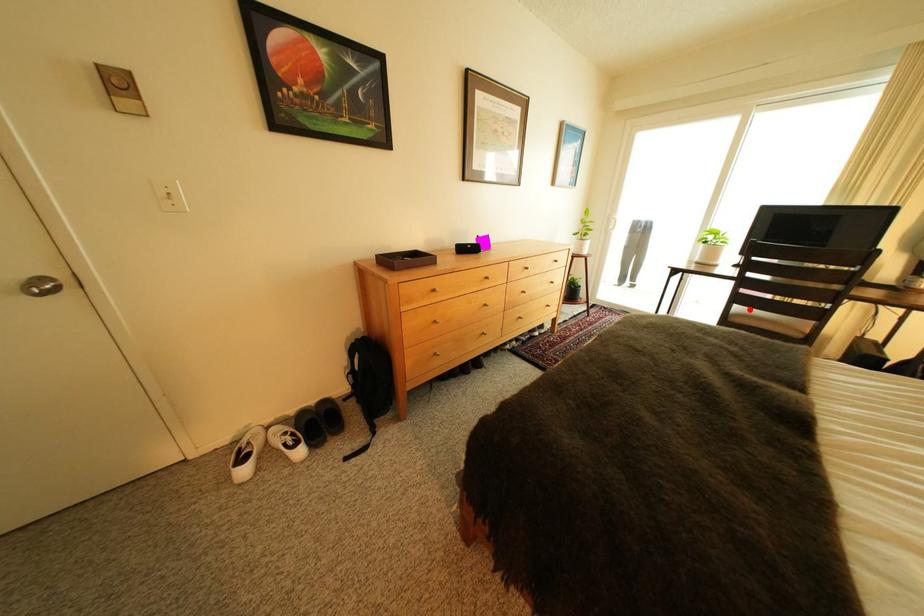
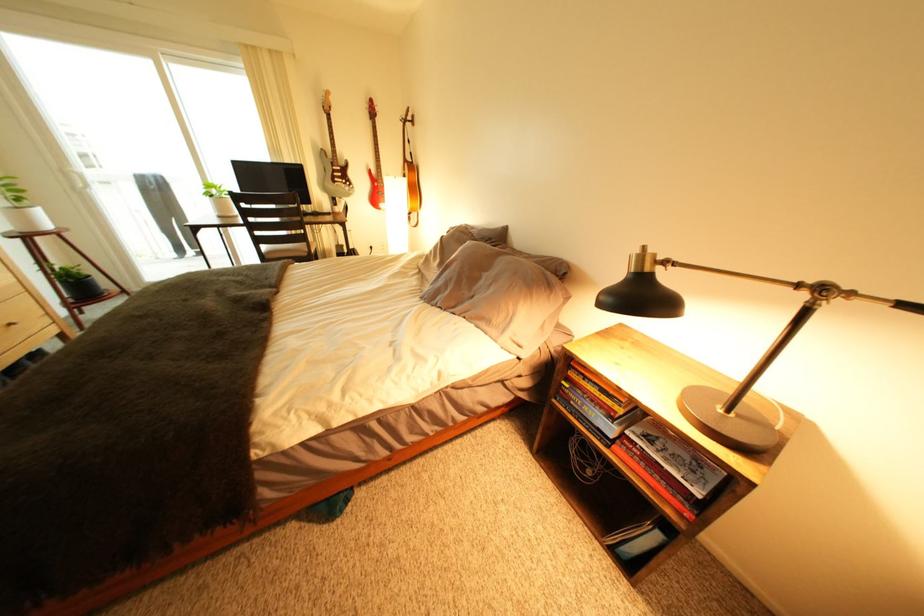
Locate, in the second image, the point that corresponds to the highlighted location in the first image.

(276, 249)